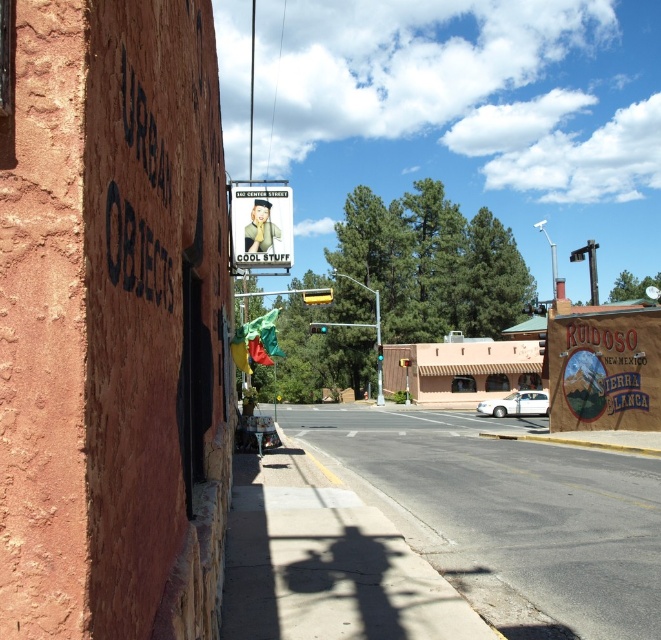
Between matte brown signboard at right and matte plastic sign at upper center, which one appears on the left side from the viewer's perspective?

matte plastic sign at upper center

Who is positioned more to the right, matte brown signboard at right or matte plastic sign at upper center?

matte brown signboard at right is more to the right.

Find the location of `matte brown signboard at right`. matte brown signboard at right is located at coordinates (603, 369).

Where is `matte brown signboard at right`? This screenshot has height=640, width=661. matte brown signboard at right is located at coordinates (603, 369).